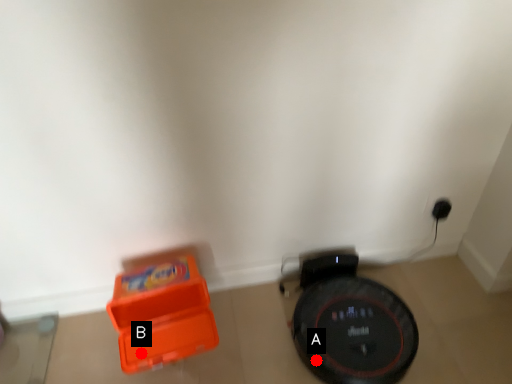
Question: Two points are circled on the image, labeled by A and B beside each circle. Which point appears farthest from the camera in this image?

Choices:
 (A) A is further
 (B) B is further

Answer: (A)